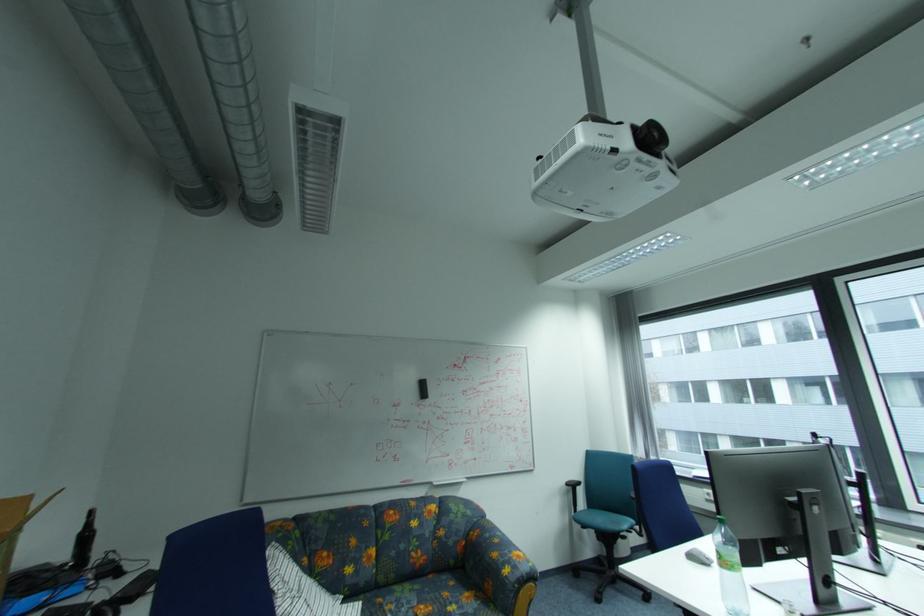
Locate an element on the screen. The height and width of the screenshot is (616, 924). black chair armrest is located at coordinates (575, 484).